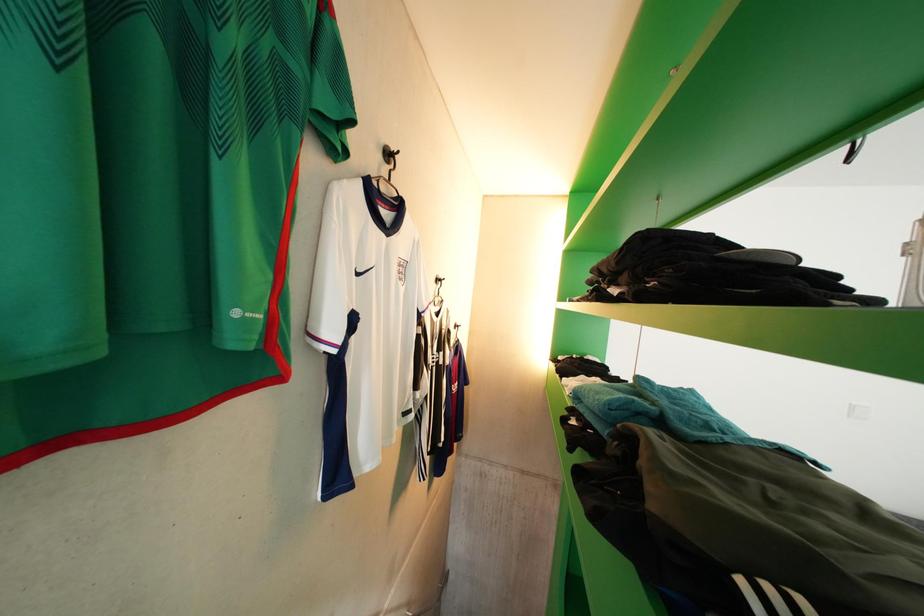
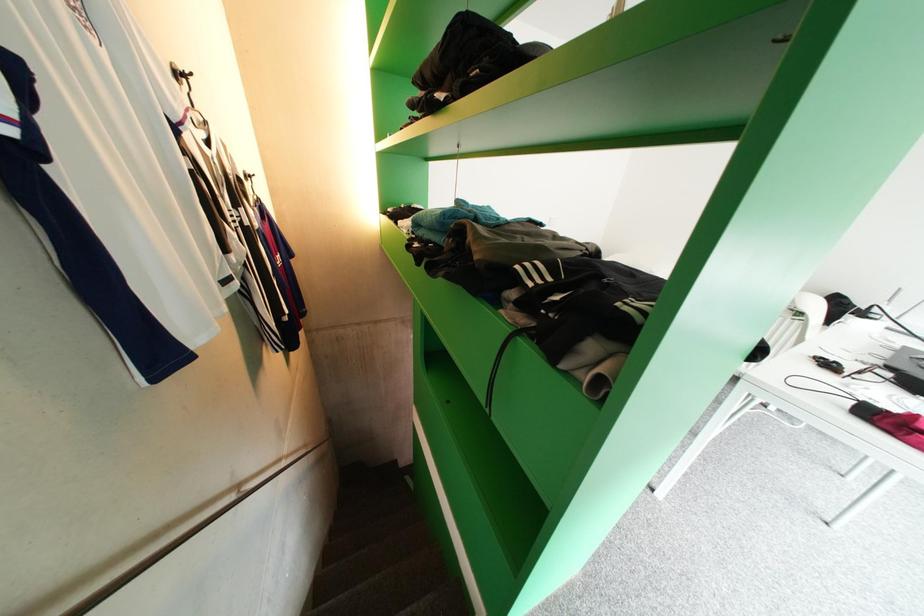
The first image is from the beginning of the video and the second image is from the end. How did the camera likely rotate when shooting the video?

The camera's rotation is toward right-down.